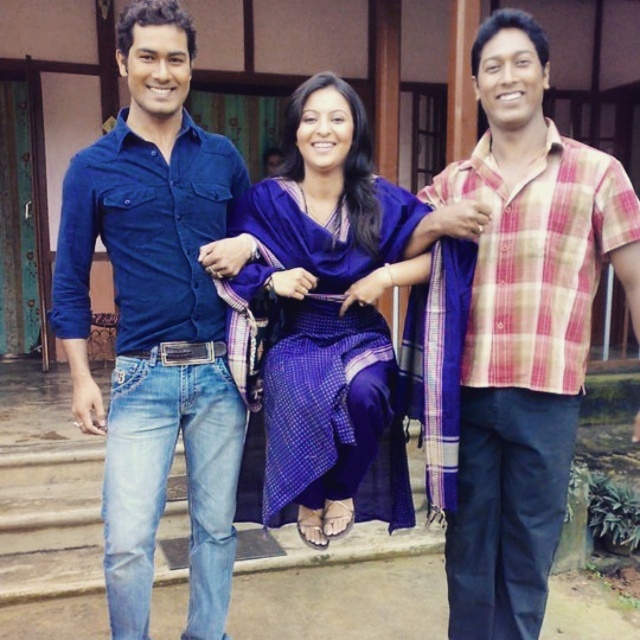
Who is more forward, (477, 228) or (305, 396)?

Point (305, 396) is in front.

Which is more to the left, plaid cotton shirt at center or purple woven saree at center?

purple woven saree at center is more to the left.

Which is in front, point (525, 330) or point (260, 262)?

Point (525, 330) is more forward.

Where is `plaid cotton shirt at center`? The height and width of the screenshot is (640, 640). plaid cotton shirt at center is located at coordinates (522, 324).

Who is more distant from viewer, (145, 269) or (268, 218)?

The point (268, 218) is more distant.

Does denim jeans at left come in front of purple woven saree at center?

That is False.

What do you see at coordinates (156, 320) in the screenshot? I see `denim jeans at left` at bounding box center [156, 320].

Where is `denim jeans at left`? Image resolution: width=640 pixels, height=640 pixels. denim jeans at left is located at coordinates (156, 320).

Can you confirm if denim jeans at left is bigger than black leather belt at center?

Indeed, denim jeans at left has a larger size compared to black leather belt at center.

In the scene shown: Can you confirm if denim jeans at left is thinner than black leather belt at center?

In fact, denim jeans at left might be wider than black leather belt at center.

Which is in front, point (140, 180) or point (163, 360)?

Positioned in front is point (140, 180).

Identify the location of denim jeans at left. (156, 320).